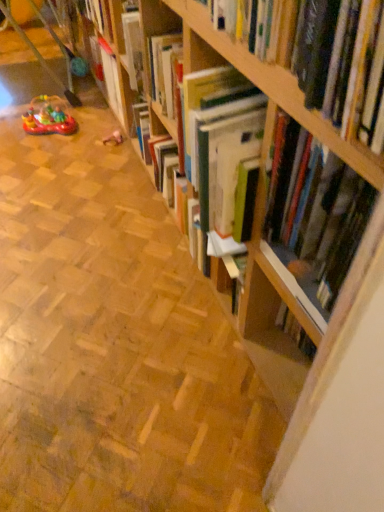
Question: From a real-world perspective, is rubber boat at left, acting as the first toy starting from the left, physically above hardcover book at upper right?

Choices:
 (A) yes
 (B) no

Answer: (B)

Question: From the image's perspective, is rubber boat at left, acting as the first toy starting from the left, located beneath hardcover book at upper right?

Choices:
 (A) no
 (B) yes

Answer: (A)

Question: From a real-world perspective, is rubber boat at left, acting as the first toy starting from the left, positioned under hardcover book at upper right based on gravity?

Choices:
 (A) no
 (B) yes

Answer: (B)

Question: From the image's perspective, does rubber boat at left, placed as the second toy when sorted from right to left, appear higher than hardcover book at upper right?

Choices:
 (A) no
 (B) yes

Answer: (B)

Question: Is rubber boat at left, placed as the second toy when sorted from right to left, at the right side of hardcover book at upper right?

Choices:
 (A) no
 (B) yes

Answer: (A)

Question: Choose the correct answer: Is hardcover book at upper right inside wooden bookshelf at center or outside it?

Choices:
 (A) inside
 (B) outside

Answer: (B)

Question: From a real-world perspective, is hardcover book at upper right physically located above or below wooden bookshelf at center?

Choices:
 (A) above
 (B) below

Answer: (A)

Question: Visually, is hardcover book at upper right positioned to the left or to the right of wooden bookshelf at center?

Choices:
 (A) right
 (B) left

Answer: (A)

Question: In terms of height, does hardcover book at upper right look taller or shorter compared to wooden bookshelf at center?

Choices:
 (A) short
 (B) tall

Answer: (B)

Question: From the image's perspective, is wooden bookshelf at center located above or below rubber boat at left, acting as the first toy starting from the left?

Choices:
 (A) above
 (B) below

Answer: (B)

Question: From a real-world perspective, is wooden bookshelf at center positioned above or below rubber boat at left, placed as the second toy when sorted from right to left?

Choices:
 (A) above
 (B) below

Answer: (B)

Question: In terms of height, does wooden bookshelf at center look taller or shorter compared to rubber boat at left, placed as the second toy when sorted from right to left?

Choices:
 (A) short
 (B) tall

Answer: (A)

Question: Is wooden bookshelf at center inside or outside of rubber boat at left, placed as the second toy when sorted from right to left?

Choices:
 (A) outside
 (B) inside

Answer: (A)

Question: Considering the positions of rubberized plastic toy at center, the second toy in the left-to-right sequence, and hardcover book at upper right in the image, is rubberized plastic toy at center, the second toy in the left-to-right sequence, taller or shorter than hardcover book at upper right?

Choices:
 (A) tall
 (B) short

Answer: (B)

Question: From a real-world perspective, relative to hardcover book at upper right, is rubberized plastic toy at center, which is the first toy in right-to-left order, vertically above or below?

Choices:
 (A) above
 (B) below

Answer: (B)